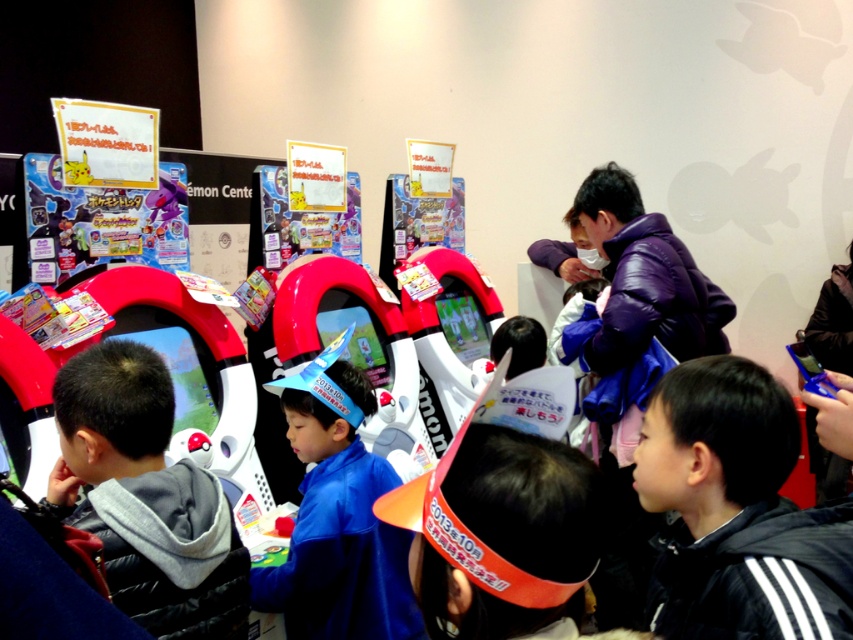
Question: From the image, what is the correct spatial relationship of black fleece jacket at lower right in relation to gray fleece jacket at left?

Choices:
 (A) above
 (B) below

Answer: (A)

Question: Among these objects, which one is nearest to the camera?

Choices:
 (A) blue fabric hat at center
 (B) black fleece jacket at lower right
 (C) gray fleece jacket at left

Answer: (B)

Question: Can you confirm if black fleece jacket at lower right is positioned to the right of gray fleece jacket at left?

Choices:
 (A) yes
 (B) no

Answer: (A)

Question: Which object is the closest to the black fleece jacket at lower right?

Choices:
 (A) gray fleece jacket at left
 (B) blue fabric hat at center

Answer: (A)

Question: Does black fleece jacket at lower right appear over gray fleece jacket at left?

Choices:
 (A) no
 (B) yes

Answer: (B)

Question: Estimate the real-world distances between objects in this image. Which object is farther from the gray fleece jacket at left?

Choices:
 (A) blue fabric hat at center
 (B) black fleece jacket at lower right

Answer: (B)